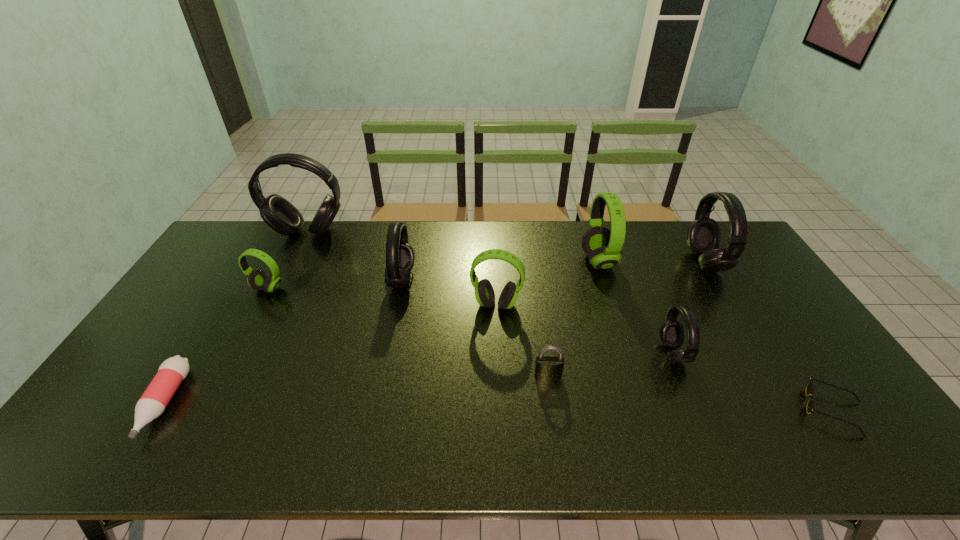
The height and width of the screenshot is (540, 960). Find the location of `vacant space located on the right of the fifth headset from left to right`. vacant space located on the right of the fifth headset from left to right is located at coordinates (651, 261).

This screenshot has width=960, height=540. Identify the location of blank area located on the earcups of the rightmost gray headset. (632, 262).

Locate an element on the screen. The width and height of the screenshot is (960, 540). vacant space located on the earcups of the rightmost gray headset is located at coordinates (669, 262).

The height and width of the screenshot is (540, 960). In order to click on vacant space located 0.240m on the earcups of the rightmost gray headset in this screenshot , I will do `click(620, 262)`.

Locate an element on the screen. The height and width of the screenshot is (540, 960). vacant space situated 0.400m on the earcups of the seventh object from right to left is located at coordinates (536, 279).

Find the location of a particular element. free space located 0.370m on the back of the second biggest green headset is located at coordinates (493, 227).

Identify the location of vacant area situated on the earcups of the eighth object from left to right. Image resolution: width=960 pixels, height=540 pixels. [640, 354].

Find the location of a particular element. free space located 0.190m on the earcups of the eighth object from left to right is located at coordinates (593, 354).

You are a GUI agent. You are given a task and a screenshot of the screen. Output one action in this format:
    pyautogui.click(x=<x>, y=<y>)
    Task: Click on the free spot located on the earcups of the eighth object from left to right
    The image size is (960, 540).
    Given the screenshot: What is the action you would take?
    pyautogui.click(x=626, y=354)

Identify the location of blank space located on the back of the leftmost green headset. The image size is (960, 540). point(301,226).